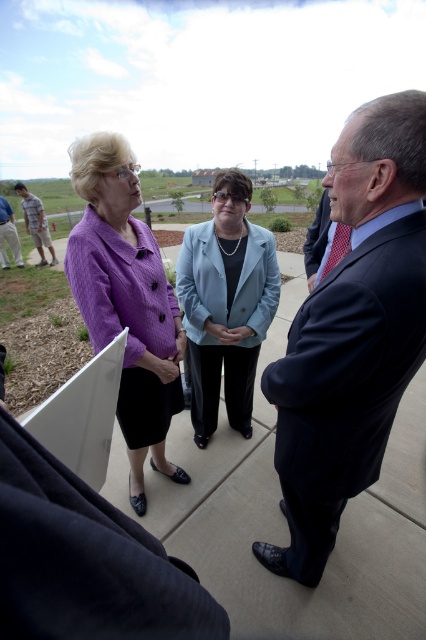
Question: Which point is farther to the camera?

Choices:
 (A) (19, 260)
 (B) (29, 198)
 (C) (408, 221)

Answer: (B)

Question: Can you confirm if dark blue suit at center is positioned to the right of khaki cotton pants at lower left?

Choices:
 (A) yes
 (B) no

Answer: (A)

Question: Among these points, which one is farthest from the camera?

Choices:
 (A) (360, 365)
 (B) (210, 339)
 (C) (118, 259)

Answer: (B)

Question: Is purple textured sweater at center bigger than khaki cotton pants at lower left?

Choices:
 (A) yes
 (B) no

Answer: (A)

Question: Which point is farther to the camera?

Choices:
 (A) (233, 192)
 (B) (178, 332)
 (C) (6, 266)
 (D) (406, 186)

Answer: (C)

Question: Is light blue fabric jacket at center to the right of khaki cotton pants at lower left from the viewer's perspective?

Choices:
 (A) no
 (B) yes

Answer: (B)